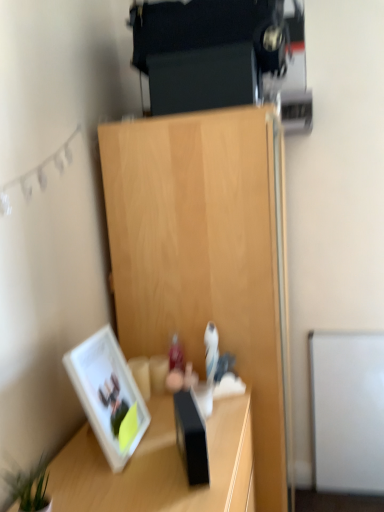
The height and width of the screenshot is (512, 384). What are the coordinates of `free location above wooden desk at lower left (from a real-world perspective)` in the screenshot? It's located at point(143,451).